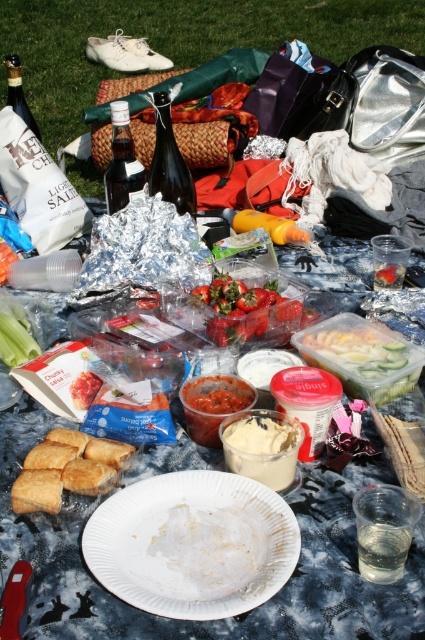
Question: Which point is farther to the camera?

Choices:
 (A) golden brown pastry at center
 (B) white creamy spread at center
 (C) green grass at upper center

Answer: (C)

Question: Which point is farther from the camera taking this photo?

Choices:
 (A) (367, 380)
 (B) (91, 385)

Answer: (B)

Question: Is green grass at upper center wider than golden brown pastry at center?

Choices:
 (A) no
 (B) yes

Answer: (B)

Question: Is shiny red strawberries at center above semi-translucent plastic container at center?

Choices:
 (A) yes
 (B) no

Answer: (A)

Question: Can you confirm if white paper plate at center is positioned to the right of translucent plastic container at center?

Choices:
 (A) no
 (B) yes

Answer: (A)

Question: Which point appears farthest from the camera in this image?

Choices:
 (A) (198, 420)
 (B) (240, 452)
 (C) (85, 396)
 (D) (300, 321)

Answer: (D)